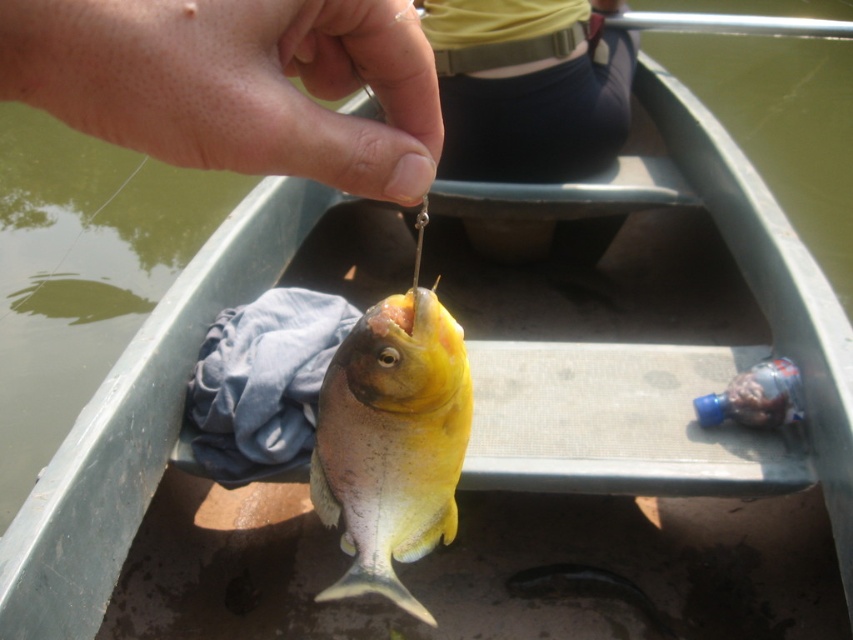
You are a fisherman on a boat and you see a dry skin at center and a yellow matte fish at center. Which object is shorter in length?

The dry skin at center is shorter than the yellow matte fish at center.

You are on a boat and see the dry skin at center and the yellow matte fish at center. Which object is closer to you?

The dry skin at center is closer to you since it is in front of the yellow matte fish at center.

You are on a boat and see the dry skin at center and the yellow matte fish at center. Which object is positioned higher relative to the other?

The dry skin at center is positioned above the yellow matte fish at center.